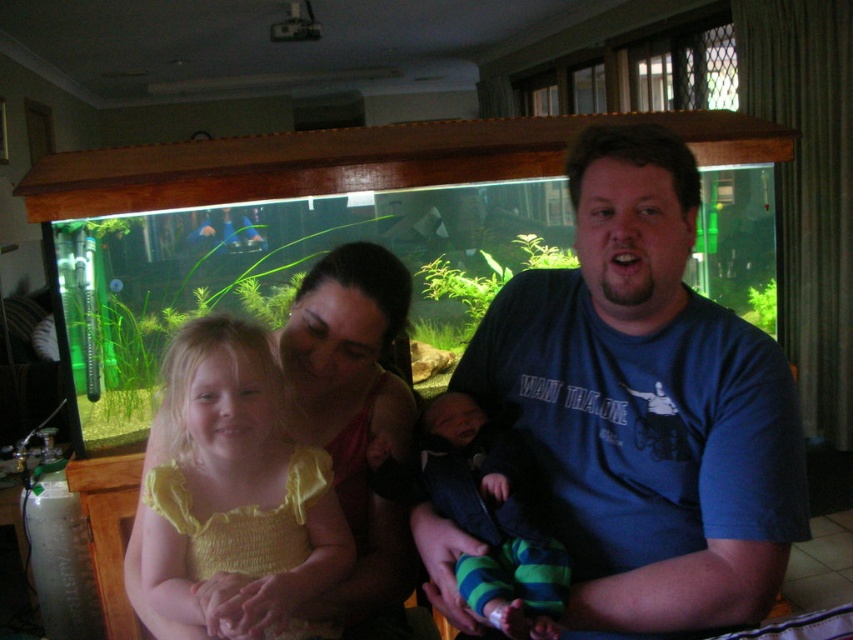
Question: From the image, what is the correct spatial relationship of blue cotton shirt at center in relation to striped knit pants at center?

Choices:
 (A) above
 (B) below

Answer: (A)

Question: Can you confirm if yellow fabric dress at center is thinner than striped knit pants at center?

Choices:
 (A) no
 (B) yes

Answer: (A)

Question: Observing the image, what is the correct spatial positioning of blue cotton shirt at center in reference to yellow fabric dress at center?

Choices:
 (A) below
 (B) above

Answer: (B)

Question: Which point is closer to the camera?

Choices:
 (A) (552, 612)
 (B) (310, 636)
 (C) (634, 228)

Answer: (A)

Question: Among these points, which one is farthest from the camera?

Choices:
 (A) (192, 470)
 (B) (480, 524)

Answer: (A)

Question: Which object appears closest to the camera in this image?

Choices:
 (A) striped knit pants at center
 (B) blue cotton shirt at center
 (C) yellow fabric dress at center

Answer: (A)